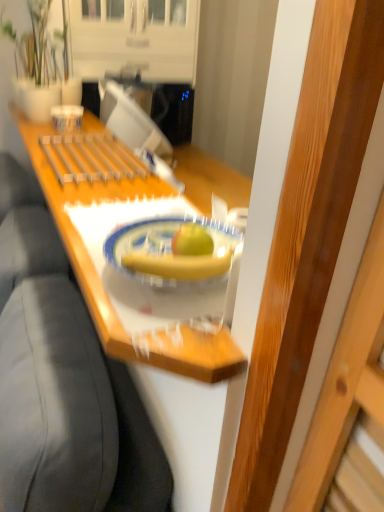
Where is `free space above porcelain plate at center (from a real-world perspective)`? The image size is (384, 512). free space above porcelain plate at center (from a real-world perspective) is located at coordinates (192, 250).